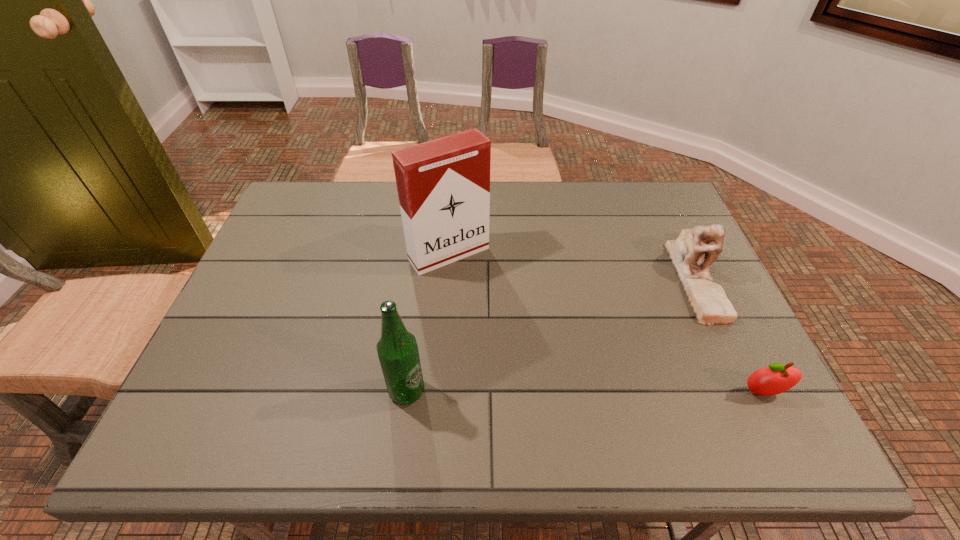
The height and width of the screenshot is (540, 960). In the image, there is a desktop. In order to click on vacant region at the near left corner in this screenshot , I will do `click(243, 405)`.

You are a GUI agent. You are given a task and a screenshot of the screen. Output one action in this format:
    pyautogui.click(x=<x>, y=<y>)
    Task: Click on the free space at the far right corner of the desktop
    This screenshot has width=960, height=540.
    Given the screenshot: What is the action you would take?
    pyautogui.click(x=638, y=183)

You are a GUI agent. You are given a task and a screenshot of the screen. Output one action in this format:
    pyautogui.click(x=<x>, y=<y>)
    Task: Click on the free region at the near right corner of the desktop
    
    Given the screenshot: What is the action you would take?
    pyautogui.click(x=702, y=370)

The image size is (960, 540). What are the coordinates of `vacant area between the figurine and the cigarette_case` in the screenshot? It's located at (572, 266).

Locate an element on the screen. This screenshot has width=960, height=540. vacant space that is in between the shortest object and the cigarette_case is located at coordinates (606, 323).

Image resolution: width=960 pixels, height=540 pixels. Identify the location of empty location between the tallest object and the figurine. (572, 266).

Image resolution: width=960 pixels, height=540 pixels. Find the location of `empty space between the cigarette_case and the second shortest object`. empty space between the cigarette_case and the second shortest object is located at coordinates (572, 266).

This screenshot has width=960, height=540. In order to click on empty space between the cigarette_case and the second shortest object in this screenshot , I will do `click(572, 266)`.

Find the location of `free space between the tallest object and the second shortest object`. free space between the tallest object and the second shortest object is located at coordinates [x=572, y=266].

At what (x,y) coordinates should I click in order to perform the action: click on free area in between the apple and the beer bottle. Please return your answer as a coordinate pair (x, y). Looking at the image, I should click on (585, 392).